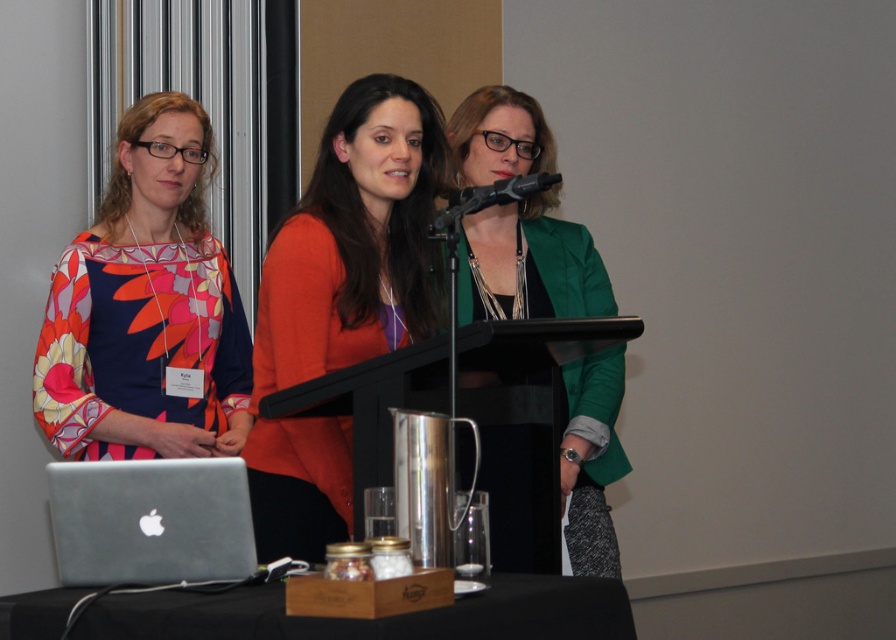
Can you confirm if floral fabric dress at left is positioned above sleek silver laptop at lower left?

Indeed, floral fabric dress at left is positioned over sleek silver laptop at lower left.

Does floral fabric dress at left have a lesser width compared to sleek silver laptop at lower left?

No.

Between point (175, 294) and point (79, 474), which one is positioned behind?

Point (175, 294)

Image resolution: width=896 pixels, height=640 pixels. What are the coordinates of `floral fabric dress at left` in the screenshot? It's located at (147, 307).

Describe the element at coordinates (530, 266) in the screenshot. I see `green matte blazer at center` at that location.

Does point (563, 480) come closer to viewer compared to point (526, 193)?

No, (563, 480) is behind (526, 193).

Between point (563, 449) and point (483, 208), which one is positioned in front?

Positioned in front is point (483, 208).

Identify the location of green matte blazer at center. The width and height of the screenshot is (896, 640). coord(530,266).

Can you confirm if black matte podium at center is wider than sleek silver laptop at lower left?

Yes, black matte podium at center is wider than sleek silver laptop at lower left.

Consider the image. Who is more forward, (544, 394) or (239, 520)?

Point (239, 520) is more forward.

Does point (467, 365) come in front of point (47, 481)?

No.

Locate an element on the screen. The width and height of the screenshot is (896, 640). black matte podium at center is located at coordinates (532, 401).